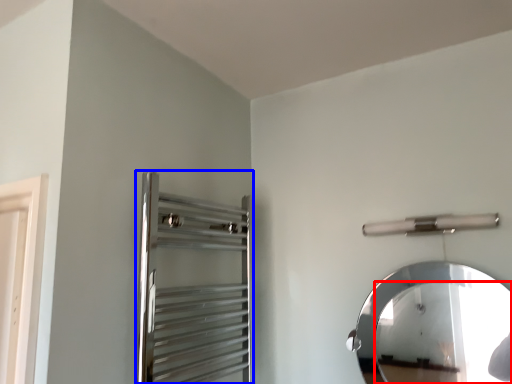
Question: Which object appears closest to the camera in this image, mirror (highlighted by a red box) or screen door (highlighted by a blue box)?

Choices:
 (A) mirror
 (B) screen door

Answer: (B)